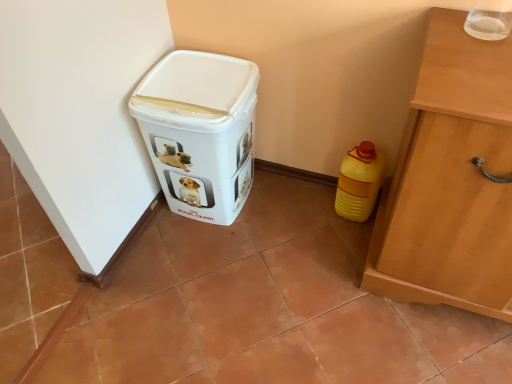
I want to click on white plastic container at lower left, so click(200, 131).

Describe the element at coordinates (200, 131) in the screenshot. The height and width of the screenshot is (384, 512). I see `white plastic container at lower left` at that location.

At what (x,y) coordinates should I click in order to perform the action: click on yellow plastic bottle at lower right. Please return your answer as a coordinate pair (x, y). The image size is (512, 384). Looking at the image, I should click on (359, 182).

The height and width of the screenshot is (384, 512). Describe the element at coordinates (359, 182) in the screenshot. I see `yellow plastic bottle at lower right` at that location.

Find the location of a particular element. The width and height of the screenshot is (512, 384). white plastic container at lower left is located at coordinates (200, 131).

Which object is positioned more to the right, white plastic container at lower left or yellow plastic bottle at lower right?

From the viewer's perspective, yellow plastic bottle at lower right appears more on the right side.

Considering the positions of objects white plastic container at lower left and yellow plastic bottle at lower right in the image provided, who is in front, white plastic container at lower left or yellow plastic bottle at lower right?

white plastic container at lower left is more forward.

Which is closer to the camera, (165, 171) or (364, 146)?

Clearly, point (165, 171) is more distant from the camera than point (364, 146).

From the image's perspective, between white plastic container at lower left and yellow plastic bottle at lower right, who is located below?

yellow plastic bottle at lower right appears lower in the image.

From a real-world perspective, is white plastic container at lower left above or below yellow plastic bottle at lower right?

white plastic container at lower left is above yellow plastic bottle at lower right.

Looking at this image, which of these two, white plastic container at lower left or yellow plastic bottle at lower right, is wider?

Wider between the two is white plastic container at lower left.

Considering the relative sizes of white plastic container at lower left and yellow plastic bottle at lower right in the image provided, is white plastic container at lower left taller than yellow plastic bottle at lower right?

Correct, white plastic container at lower left is much taller as yellow plastic bottle at lower right.

Considering the sizes of white plastic container at lower left and yellow plastic bottle at lower right in the image, is white plastic container at lower left bigger or smaller than yellow plastic bottle at lower right?

white plastic container at lower left is bigger than yellow plastic bottle at lower right.

Is white plastic container at lower left outside of yellow plastic bottle at lower right?

Indeed, white plastic container at lower left is completely outside yellow plastic bottle at lower right.

Would you say white plastic container at lower left is a long distance from yellow plastic bottle at lower right?

No, there isn't a large distance between white plastic container at lower left and yellow plastic bottle at lower right.

Is white plastic container at lower left positioned with its back to yellow plastic bottle at lower right?

That's not correct — white plastic container at lower left is not looking away from yellow plastic bottle at lower right.

What's the angular difference between white plastic container at lower left and yellow plastic bottle at lower right's facing directions?

1.4 degrees separate the facing orientations of white plastic container at lower left and yellow plastic bottle at lower right.

Find the location of a particular element. bottle to the right of white plastic container at lower left is located at coordinates (359, 182).

Can you confirm if yellow plastic bottle at lower right is positioned to the right of white plastic container at lower left?

Yes, yellow plastic bottle at lower right is to the right of white plastic container at lower left.

Which object is closer to the camera taking this photo, yellow plastic bottle at lower right or white plastic container at lower left?

white plastic container at lower left.

Considering the positions of points (360, 191) and (198, 177), is point (360, 191) closer to camera compared to point (198, 177)?

No, (360, 191) is further to viewer.

From the image's perspective, is yellow plastic bottle at lower right over white plastic container at lower left?

No.

From a real-world perspective, is yellow plastic bottle at lower right below white plastic container at lower left?

Yes, from a real-world perspective, yellow plastic bottle at lower right is beneath white plastic container at lower left.

In terms of width, does yellow plastic bottle at lower right look wider or thinner when compared to white plastic container at lower left?

In the image, yellow plastic bottle at lower right appears to be more narrow than white plastic container at lower left.

Considering the sizes of objects yellow plastic bottle at lower right and white plastic container at lower left in the image provided, who is taller, yellow plastic bottle at lower right or white plastic container at lower left?

With more height is white plastic container at lower left.

Who is smaller, yellow plastic bottle at lower right or white plastic container at lower left?

yellow plastic bottle at lower right is smaller.

Which is correct: yellow plastic bottle at lower right is inside white plastic container at lower left, or outside of it?

yellow plastic bottle at lower right is not enclosed by white plastic container at lower left.

Is yellow plastic bottle at lower right not close to white plastic container at lower left?

No, there isn't a large distance between yellow plastic bottle at lower right and white plastic container at lower left.

Is yellow plastic bottle at lower right oriented away from white plastic container at lower left?

No, white plastic container at lower left is not at the back of yellow plastic bottle at lower right.

How many degrees apart are the facing directions of yellow plastic bottle at lower right and white plastic container at lower left?

The facing directions of yellow plastic bottle at lower right and white plastic container at lower left are 1.4 degrees apart.

The height and width of the screenshot is (384, 512). Find the location of `waste container above the yellow plastic bottle at lower right (from the image's perspective)`. waste container above the yellow plastic bottle at lower right (from the image's perspective) is located at coordinates (200, 131).

Where is `bottle that appears below the white plastic container at lower left (from the image's perspective)`? bottle that appears below the white plastic container at lower left (from the image's perspective) is located at coordinates (359, 182).

I want to click on waste container on the left of the yellow plastic bottle at lower right, so click(x=200, y=131).